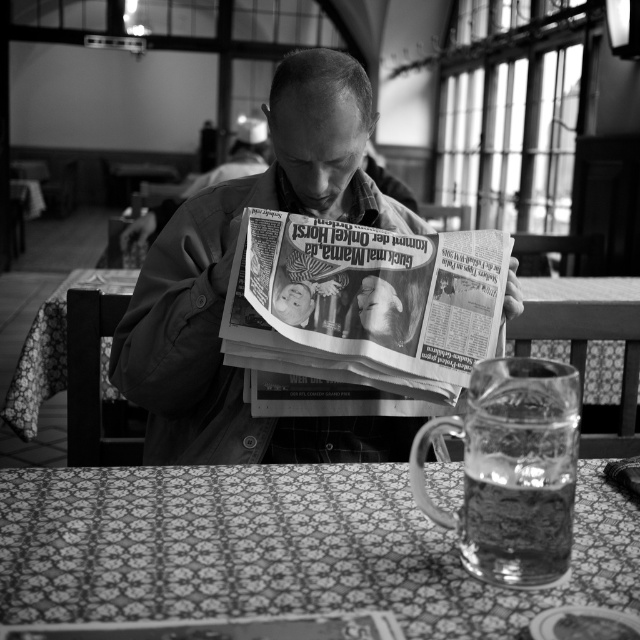
You are a delivery person who needs to place a small package on the table between the matte newspaper at center and the printed newspaper at center. Can you fit it there?

The matte newspaper at center might be wider than printed newspaper at center, so there may not be enough space between them to fit the small package.